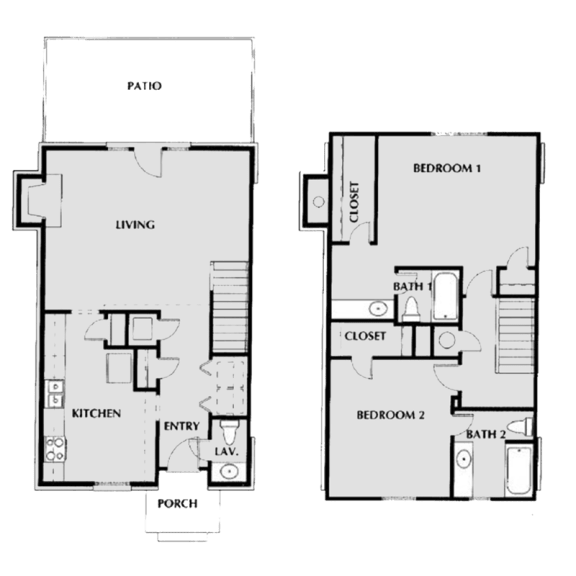
Where is `bedrooms`? bedrooms is located at coordinates (388, 422), (454, 208).